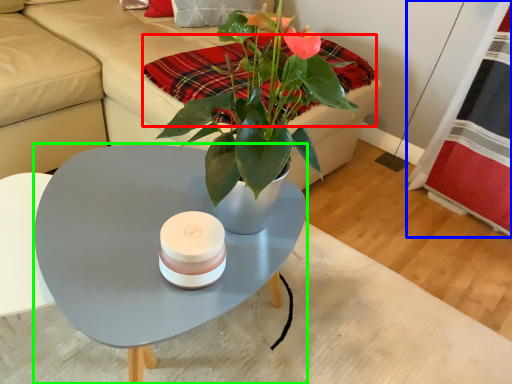
Question: Considering the real-world distances, which object is closest to blanket (highlighted by a red box)? plaid (highlighted by a blue box) or coffee table (highlighted by a green box).

Choices:
 (A) plaid
 (B) coffee table

Answer: (B)